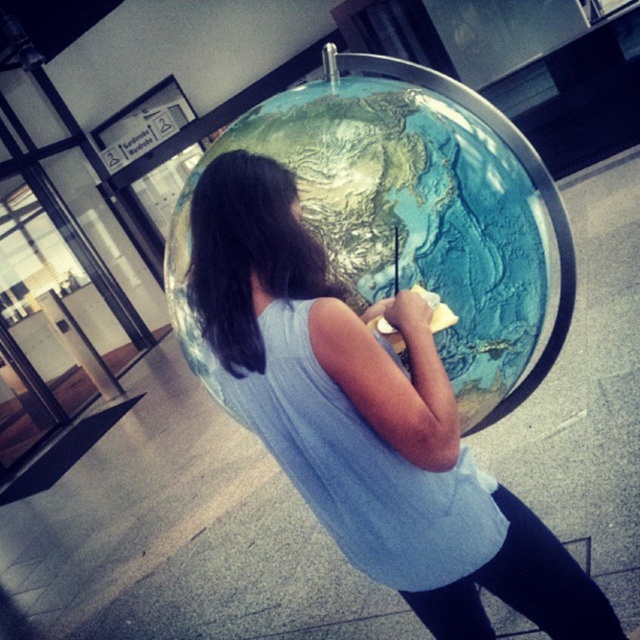
Question: Does matte blue shirt at center have a lesser width compared to matte blue globe at center?

Choices:
 (A) yes
 (B) no

Answer: (A)

Question: Does matte blue shirt at center appear over matte blue globe at center?

Choices:
 (A) no
 (B) yes

Answer: (A)

Question: Where is matte blue shirt at center located in relation to matte blue globe at center in the image?

Choices:
 (A) above
 (B) below

Answer: (B)

Question: Which of the following is the closest to the observer?

Choices:
 (A) (390, 320)
 (B) (422, 161)

Answer: (A)

Question: Which point is farther to the camera?

Choices:
 (A) (524, 196)
 (B) (259, 262)

Answer: (A)